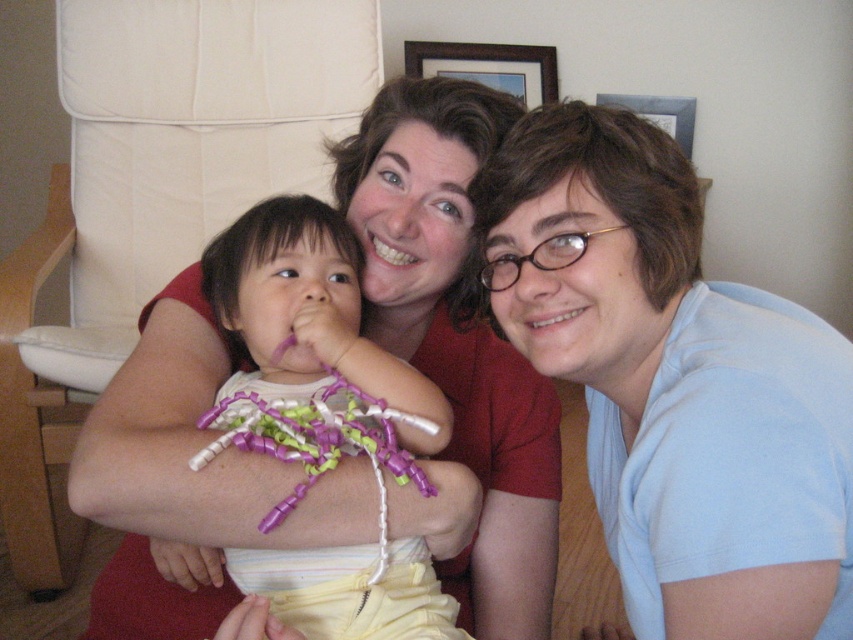
Question: Does matte plastic toy at center have a lesser width compared to purple plastic toy at center?

Choices:
 (A) yes
 (B) no

Answer: (B)

Question: Is blue cotton shirt at upper right further to the viewer compared to matte plastic toy at center?

Choices:
 (A) yes
 (B) no

Answer: (B)

Question: Is matte plastic toy at center above purple plastic toy at center?

Choices:
 (A) yes
 (B) no

Answer: (A)

Question: Which of the following is the farthest from the observer?

Choices:
 (A) (431, 602)
 (B) (833, 410)

Answer: (A)

Question: Considering the real-world distances, which object is closest to the purple plastic toy at center?

Choices:
 (A) matte plastic toy at center
 (B) blue cotton shirt at upper right
 (C) white fabric armchair at upper left

Answer: (A)

Question: Estimate the real-world distances between objects in this image. Which object is closer to the purple plastic toy at center?

Choices:
 (A) white fabric armchair at upper left
 (B) blue cotton shirt at upper right
 (C) matte plastic toy at center

Answer: (C)